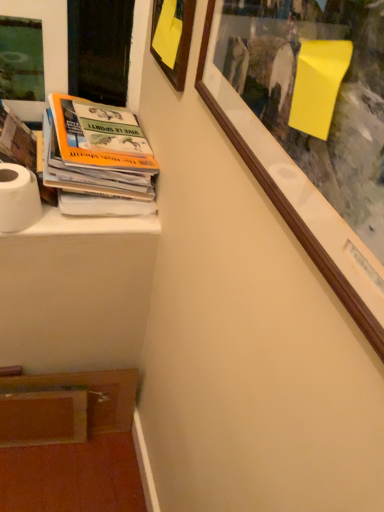
Question: Is wooden picture frame at upper left, the 1th picture frame in the left-to-right sequence, to the left of wooden picture frame at upper center, which appears as the second picture frame when viewed from the left, from the viewer's perspective?

Choices:
 (A) yes
 (B) no

Answer: (A)

Question: Is wooden picture frame at upper left, placed as the second picture frame when sorted from right to left, not near wooden picture frame at upper center, which appears as the second picture frame when viewed from the left?

Choices:
 (A) no
 (B) yes

Answer: (A)

Question: Considering the relative positions of wooden picture frame at upper left, placed as the second picture frame when sorted from right to left, and wooden picture frame at upper center, which appears as the second picture frame when viewed from the left, in the image provided, is wooden picture frame at upper left, placed as the second picture frame when sorted from right to left, to the right of wooden picture frame at upper center, which appears as the second picture frame when viewed from the left, from the viewer's perspective?

Choices:
 (A) no
 (B) yes

Answer: (A)

Question: Is wooden picture frame at upper center, the first picture frame in the right-to-left sequence, a part of wooden picture frame at upper left, placed as the second picture frame when sorted from right to left?

Choices:
 (A) yes
 (B) no

Answer: (B)

Question: From a real-world perspective, is wooden picture frame at upper left, placed as the second picture frame when sorted from right to left, located beneath wooden picture frame at upper center, the first picture frame in the right-to-left sequence?

Choices:
 (A) no
 (B) yes

Answer: (B)

Question: Is white matte toilet paper at lower left in front of or behind white paper stack at left in the image?

Choices:
 (A) behind
 (B) front

Answer: (B)

Question: From the image's perspective, is white matte toilet paper at lower left above or below white paper stack at left?

Choices:
 (A) below
 (B) above

Answer: (A)

Question: In terms of width, does white matte toilet paper at lower left look wider or thinner when compared to white paper stack at left?

Choices:
 (A) wide
 (B) thin

Answer: (B)

Question: In terms of height, does white matte toilet paper at lower left look taller or shorter compared to white paper stack at left?

Choices:
 (A) tall
 (B) short

Answer: (B)

Question: From a real-world perspective, is white matte toilet paper at lower left positioned above or below wooden picture frame at upper center, the first picture frame in the right-to-left sequence?

Choices:
 (A) below
 (B) above

Answer: (A)

Question: Is white matte toilet paper at lower left spatially inside wooden picture frame at upper center, the first picture frame in the right-to-left sequence, or outside of it?

Choices:
 (A) outside
 (B) inside

Answer: (A)

Question: From the image's perspective, relative to wooden picture frame at upper center, which appears as the second picture frame when viewed from the left, is white matte toilet paper at lower left above or below?

Choices:
 (A) below
 (B) above

Answer: (A)

Question: Relative to wooden picture frame at upper center, the first picture frame in the right-to-left sequence, is white matte toilet paper at lower left in front or behind?

Choices:
 (A) front
 (B) behind

Answer: (B)

Question: Is point (26, 110) closer or farther from the camera than point (129, 161)?

Choices:
 (A) farther
 (B) closer

Answer: (A)

Question: Which is correct: wooden picture frame at upper left, placed as the second picture frame when sorted from right to left, is inside white paper stack at left, or outside of it?

Choices:
 (A) inside
 (B) outside

Answer: (B)